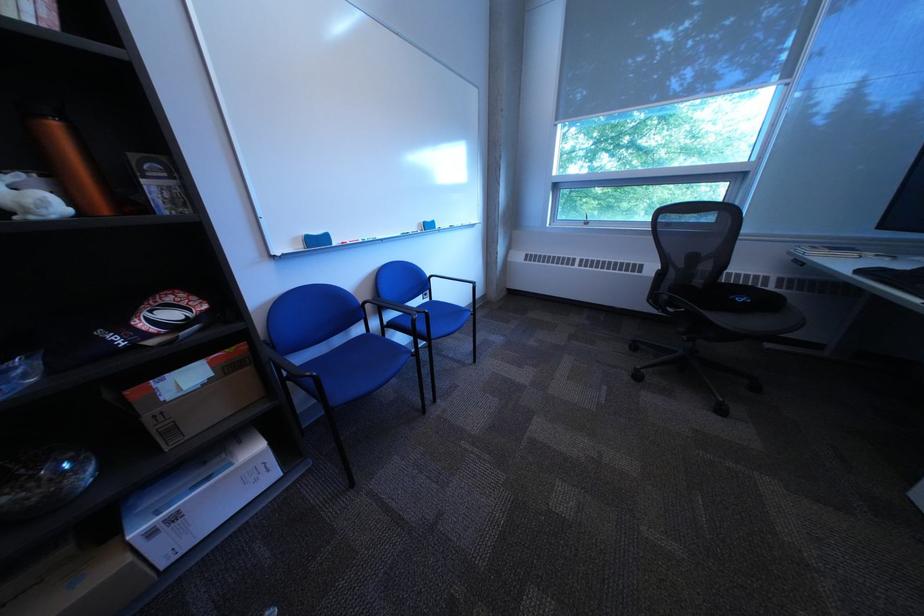
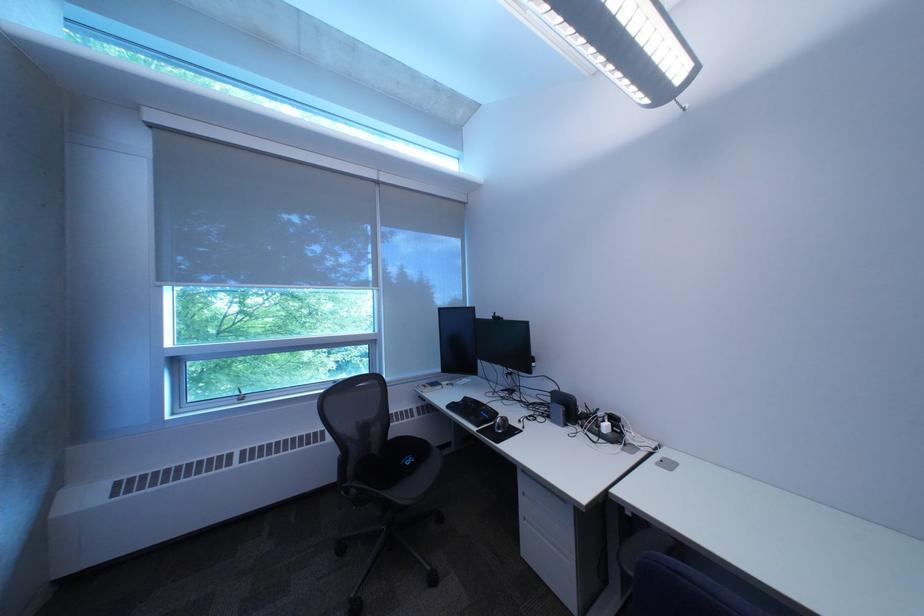
The point at [758,300] is marked in the first image. Where is the corresponding point in the second image?

(423, 461)